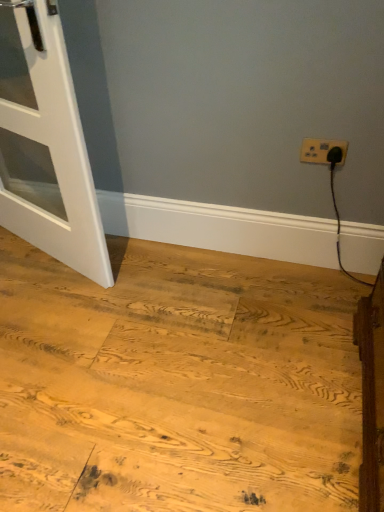
Question: Is natural wood floor at lower left looking in the opposite direction of white matte door at left?

Choices:
 (A) no
 (B) yes

Answer: (A)

Question: From a real-world perspective, is natural wood floor at lower left positioned over white matte door at left based on gravity?

Choices:
 (A) yes
 (B) no

Answer: (B)

Question: Would you say white matte door at left is part of natural wood floor at lower left's contents?

Choices:
 (A) yes
 (B) no

Answer: (B)

Question: Does natural wood floor at lower left have a lesser width compared to white matte door at left?

Choices:
 (A) yes
 (B) no

Answer: (B)

Question: Is the depth of natural wood floor at lower left greater than that of white matte door at left?

Choices:
 (A) no
 (B) yes

Answer: (A)

Question: Considering the relative positions of white plastic power plugs and sockets at upper right and natural wood floor at lower left in the image provided, is white plastic power plugs and sockets at upper right to the left or to the right of natural wood floor at lower left?

Choices:
 (A) left
 (B) right

Answer: (B)

Question: Do you think white plastic power plugs and sockets at upper right is within natural wood floor at lower left, or outside of it?

Choices:
 (A) outside
 (B) inside

Answer: (A)

Question: Based on their sizes in the image, would you say white plastic power plugs and sockets at upper right is bigger or smaller than natural wood floor at lower left?

Choices:
 (A) big
 (B) small

Answer: (B)

Question: Is white plastic power plugs and sockets at upper right taller or shorter than natural wood floor at lower left?

Choices:
 (A) tall
 (B) short

Answer: (A)

Question: Is point (268, 437) closer or farther from the camera than point (4, 159)?

Choices:
 (A) farther
 (B) closer

Answer: (B)

Question: Looking at the image, does natural wood floor at lower left seem bigger or smaller compared to white matte door at left?

Choices:
 (A) small
 (B) big

Answer: (B)

Question: In terms of width, does natural wood floor at lower left look wider or thinner when compared to white matte door at left?

Choices:
 (A) thin
 (B) wide

Answer: (B)

Question: Relative to white matte door at left, is natural wood floor at lower left in front or behind?

Choices:
 (A) front
 (B) behind

Answer: (A)

Question: Is natural wood floor at lower left in front of or behind white plastic power plugs and sockets at upper right in the image?

Choices:
 (A) front
 (B) behind

Answer: (A)

Question: Considering the positions of natural wood floor at lower left and white plastic power plugs and sockets at upper right in the image, is natural wood floor at lower left wider or thinner than white plastic power plugs and sockets at upper right?

Choices:
 (A) wide
 (B) thin

Answer: (A)